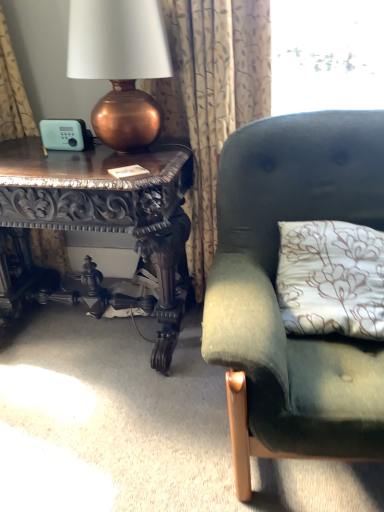
The width and height of the screenshot is (384, 512). What do you see at coordinates (275, 293) in the screenshot? I see `velvet green couch at right` at bounding box center [275, 293].

Locate an element on the screen. This screenshot has height=512, width=384. copper metallic lamp at left is located at coordinates (120, 65).

Where is `carved wood table at left`? carved wood table at left is located at coordinates (97, 225).

Is velvet green couch at right bigger or smaller than patterned fabric curtain at upper left?

In the image, velvet green couch at right appears to be larger than patterned fabric curtain at upper left.

Looking at this image, is velvet green couch at right further to the viewer compared to patterned fabric curtain at upper left?

No, velvet green couch at right is closer to the viewer.

From the image's perspective, is velvet green couch at right above patterned fabric curtain at upper left?

Incorrect, from the image's perspective, velvet green couch at right is lower than patterned fabric curtain at upper left.

Is velvet green couch at right beside carved wood table at left?

velvet green couch at right is not next to carved wood table at left, and they're not touching.

Considering the sizes of objects velvet green couch at right and carved wood table at left in the image provided, who is wider, velvet green couch at right or carved wood table at left?

velvet green couch at right is wider.

Considering the relative positions of velvet green couch at right and carved wood table at left in the image provided, is velvet green couch at right in front of carved wood table at left?

Yes, it is in front of carved wood table at left.

Considering the sizes of objects patterned fabric curtain at upper left and velvet green couch at right in the image provided, who is smaller, patterned fabric curtain at upper left or velvet green couch at right?

Smaller between the two is patterned fabric curtain at upper left.

From a real-world perspective, is patterned fabric curtain at upper left on velvet green couch at right?

Yes, from a real-world perspective, patterned fabric curtain at upper left is above velvet green couch at right.

Is patterned fabric curtain at upper left outside of velvet green couch at right?

patterned fabric curtain at upper left is positioned outside velvet green couch at right.

Considering the positions of objects patterned fabric curtain at upper left and velvet green couch at right in the image provided, who is in front, patterned fabric curtain at upper left or velvet green couch at right?

velvet green couch at right is in front.

Considering the sizes of copper metallic lamp at left and velvet green couch at right in the image, is copper metallic lamp at left wider or thinner than velvet green couch at right?

copper metallic lamp at left is thinner than velvet green couch at right.

Is point (74, 28) positioned in front of point (302, 114)?

Yes.

Would you consider copper metallic lamp at left to be distant from velvet green couch at right?

No, copper metallic lamp at left is not far away from velvet green couch at right.

From a real-world perspective, is copper metallic lamp at left under velvet green couch at right?

No, from a real-world perspective, copper metallic lamp at left is not under velvet green couch at right.

From the picture: Can carved wood table at left be found inside copper metallic lamp at left?

No, carved wood table at left is located outside of copper metallic lamp at left.

From a real-world perspective, relative to carved wood table at left, is copper metallic lamp at left vertically above or below?

In terms of real-world spatial position, copper metallic lamp at left is above carved wood table at left.

The image size is (384, 512). In order to click on table below the copper metallic lamp at left (from a real-world perspective) in this screenshot , I will do `click(97, 225)`.

Which of these two, copper metallic lamp at left or carved wood table at left, stands shorter?

copper metallic lamp at left is shorter.

In the scene shown: Is carved wood table at left behind copper metallic lamp at left?

Yes.

In the scene shown: Which of these two, carved wood table at left or copper metallic lamp at left, stands taller?

With more height is carved wood table at left.

Based on the photo, from a real-world perspective, is carved wood table at left physically located above or below copper metallic lamp at left?

carved wood table at left is situated lower than copper metallic lamp at left in the real world.

Does carved wood table at left turn towards copper metallic lamp at left?

No.

This screenshot has width=384, height=512. Identify the location of table below the patterned fabric curtain at upper left (from the image's perspective). (97, 225).

Does patterned fabric curtain at upper left come behind carved wood table at left?

Yes, the depth of patterned fabric curtain at upper left is greater than that of carved wood table at left.

Locate an element on the screen. The width and height of the screenshot is (384, 512). curtain lying above the velvet green couch at right (from the image's perspective) is located at coordinates (212, 98).

Locate an element on the screen. Image resolution: width=384 pixels, height=512 pixels. table behind the velvet green couch at right is located at coordinates (97, 225).

When comparing their distances from patterned fabric curtain at upper left, does velvet green couch at right or copper metallic lamp at left seem further?

velvet green couch at right is positioned further to the anchor patterned fabric curtain at upper left.

When comparing their distances from copper metallic lamp at left, does patterned fabric curtain at upper left or velvet green couch at right seem further?

Based on the image, velvet green couch at right appears to be further to copper metallic lamp at left.

Which object lies nearer to the anchor point copper metallic lamp at left, patterned fabric curtain at upper left or carved wood table at left?

patterned fabric curtain at upper left is closer to copper metallic lamp at left.

From the image, which object appears to be nearer to velvet green couch at right, carved wood table at left or copper metallic lamp at left?

carved wood table at left lies closer to velvet green couch at right than the other object.

When comparing their distances from velvet green couch at right, does patterned fabric curtain at upper left or carved wood table at left seem further?

carved wood table at left lies further to velvet green couch at right than the other object.

Looking at the image, which one is located closer to patterned fabric curtain at upper left, velvet green couch at right or carved wood table at left?

carved wood table at left is positioned closer to the anchor patterned fabric curtain at upper left.

Considering their positions, is patterned fabric curtain at upper left positioned further to carved wood table at left than copper metallic lamp at left?

copper metallic lamp at left is further to carved wood table at left.

Estimate the real-world distances between objects in this image. Which object is further from copper metallic lamp at left, carved wood table at left or velvet green couch at right?

The object further to copper metallic lamp at left is velvet green couch at right.

Image resolution: width=384 pixels, height=512 pixels. Find the location of `curtain between carved wood table at left and velvet green couch at right from left to right`. curtain between carved wood table at left and velvet green couch at right from left to right is located at coordinates (212, 98).

You are a GUI agent. You are given a task and a screenshot of the screen. Output one action in this format:
    pyautogui.click(x=<x>, y=<y>)
    Task: Click on the curtain that lies between copper metallic lamp at left and velvet green couch at right from top to bottom
    The height and width of the screenshot is (512, 384).
    Given the screenshot: What is the action you would take?
    pyautogui.click(x=212, y=98)

I want to click on curtain between copper metallic lamp at left and carved wood table at left in the vertical direction, so [212, 98].

Find the location of `lamp between carved wood table at left and velvet green couch at right in the horizontal direction`. lamp between carved wood table at left and velvet green couch at right in the horizontal direction is located at coordinates (120, 65).